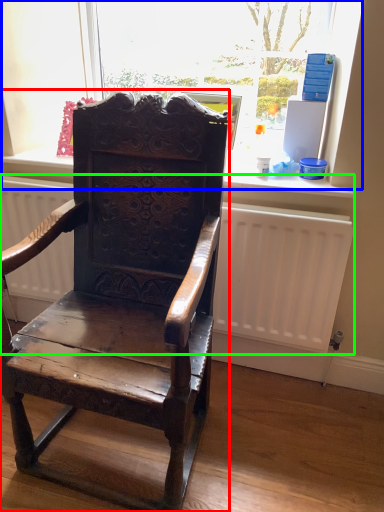
Question: Which is farther away from chair (highlighted by a red box)? bay window (highlighted by a blue box) or radiator (highlighted by a green box)?

Choices:
 (A) bay window
 (B) radiator

Answer: (A)